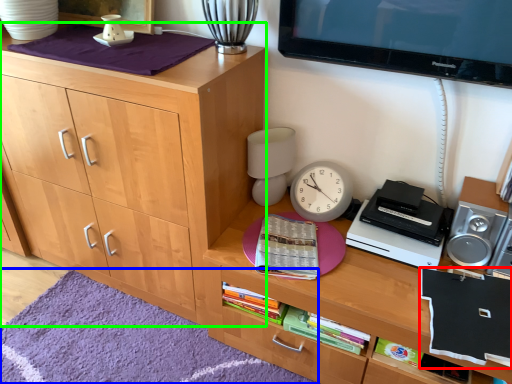
Question: Considering the real-world distances, which object is farthest from book (highlighted by a red box)? mat (highlighted by a blue box) or cabinetry (highlighted by a green box)?

Choices:
 (A) mat
 (B) cabinetry

Answer: (B)